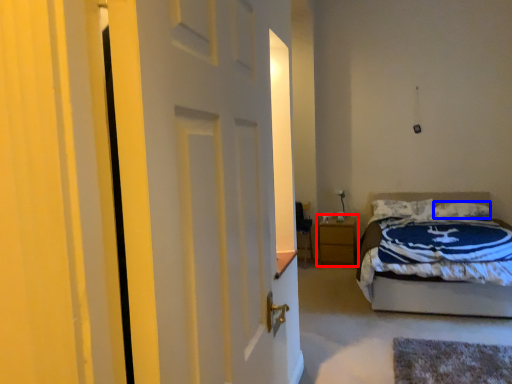
Question: Among these objects, which one is nearest to the camera, nightstand (highlighted by a red box) or pillow (highlighted by a blue box)?

Choices:
 (A) nightstand
 (B) pillow

Answer: (B)